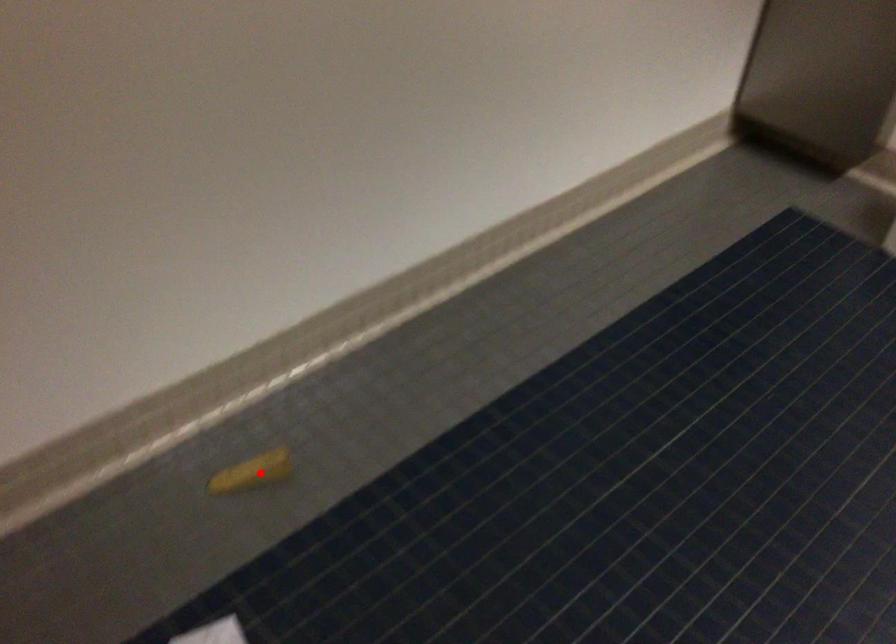
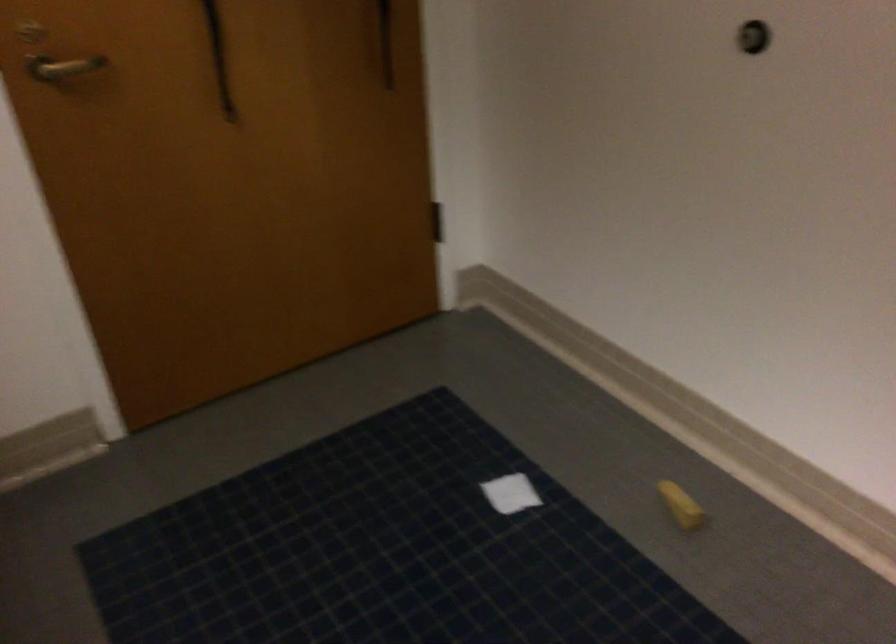
Question: I am providing you with two images of the same scene from different viewpoints. A red point is shown in image1. For the corresponding object point in image2, is it positioned nearer or farther from the camera?

Choices:
 (A) Nearer
 (B) Farther

Answer: (B)